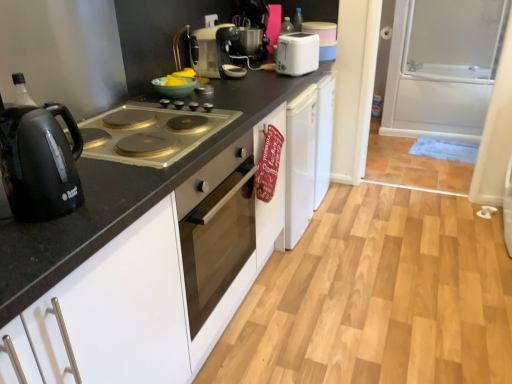
In order to click on matte silver toaster at upper center, the second kitchen appliance in the top-to-bottom sequence in this screenshot , I will do `click(211, 49)`.

Where is `matte black oven at center`? The width and height of the screenshot is (512, 384). matte black oven at center is located at coordinates (377, 297).

Where is `matte silver gas stove at left`? Image resolution: width=512 pixels, height=384 pixels. matte silver gas stove at left is located at coordinates (150, 133).

This screenshot has width=512, height=384. What do you see at coordinates (136, 257) in the screenshot?
I see `black matte countertop at center` at bounding box center [136, 257].

Locate an element on the screen. The height and width of the screenshot is (384, 512). black matte countertop at center is located at coordinates (136, 257).

What is the approximate width of white plastic toaster at upper center, acting as the third kitchen appliance starting from the bottom?

6.72 inches.

Image resolution: width=512 pixels, height=384 pixels. What do you see at coordinates (442, 67) in the screenshot?
I see `transparent glass screen door at right` at bounding box center [442, 67].

This screenshot has width=512, height=384. What are the coordinates of `matte silver toaster at upper center, the second kitchen appliance in the top-to-bottom sequence` in the screenshot? It's located at (211, 49).

Considering the relative sizes of black glossy electric kettle at left, which is the first kitchen appliance from bottom to top, and transparent glass screen door at right in the image provided, is black glossy electric kettle at left, which is the first kitchen appliance from bottom to top, shorter than transparent glass screen door at right?

Yes, black glossy electric kettle at left, which is the first kitchen appliance from bottom to top, is shorter than transparent glass screen door at right.

Who is bigger, black glossy electric kettle at left, which is the first kitchen appliance from bottom to top, or transparent glass screen door at right?

transparent glass screen door at right is bigger.

Locate an element on the screen. The image size is (512, 384). screen door that is behind the black glossy electric kettle at left, which is the first kitchen appliance from bottom to top is located at coordinates (442, 67).

Could you tell me if black glossy electric kettle at left, acting as the 3th kitchen appliance starting from the back, is facing transparent glass screen door at right?

No, black glossy electric kettle at left, acting as the 3th kitchen appliance starting from the back, is not aimed at transparent glass screen door at right.

Which is more to the left, matte silver toaster at upper center, marked as the 2th kitchen appliance in a left-to-right arrangement, or white plastic toaster at upper center, acting as the third kitchen appliance starting from the bottom?

matte silver toaster at upper center, marked as the 2th kitchen appliance in a left-to-right arrangement.

From the image's perspective, is matte silver toaster at upper center, marked as the 2th kitchen appliance in a left-to-right arrangement, above or below white plastic toaster at upper center, which appears as the first kitchen appliance when viewed from the top?

Clearly, from the image's perspective, matte silver toaster at upper center, marked as the 2th kitchen appliance in a left-to-right arrangement, is below white plastic toaster at upper center, which appears as the first kitchen appliance when viewed from the top.

Considering the sizes of matte silver toaster at upper center, marked as the 2th kitchen appliance in a left-to-right arrangement, and white plastic toaster at upper center, the first kitchen appliance from the back, in the image, is matte silver toaster at upper center, marked as the 2th kitchen appliance in a left-to-right arrangement, wider or thinner than white plastic toaster at upper center, the first kitchen appliance from the back,?

matte silver toaster at upper center, marked as the 2th kitchen appliance in a left-to-right arrangement, is wider than white plastic toaster at upper center, the first kitchen appliance from the back.

Would you consider matte silver toaster at upper center, the 2th kitchen appliance positioned from the front, to be distant from white plastic toaster at upper center, acting as the third kitchen appliance starting from the bottom?

matte silver toaster at upper center, the 2th kitchen appliance positioned from the front, is actually quite close to white plastic toaster at upper center, acting as the third kitchen appliance starting from the bottom.

Is point (335, 240) positioned behind point (31, 372)?

Yes, it is behind point (31, 372).

Is black matte countertop at center at the back of matte black oven at center?

No, matte black oven at center is not facing away from black matte countertop at center.

From the image's perspective, between matte black oven at center and black matte countertop at center, who is located below?

matte black oven at center, from the image's perspective.

Considering the positions of objects matte black oven at center and black matte countertop at center in the image provided, who is behind, matte black oven at center or black matte countertop at center?

matte black oven at center is further away from the camera.

Is black glossy electric kettle at left, positioned as the first kitchen appliance in left-to-right order, taller than matte silver gas stove at left?

Correct, black glossy electric kettle at left, positioned as the first kitchen appliance in left-to-right order, is much taller as matte silver gas stove at left.

How much distance is there between black glossy electric kettle at left, which is the first kitchen appliance from bottom to top, and matte silver gas stove at left?

A distance of 26.65 centimeters exists between black glossy electric kettle at left, which is the first kitchen appliance from bottom to top, and matte silver gas stove at left.

Image resolution: width=512 pixels, height=384 pixels. I want to click on gas stove behind the black glossy electric kettle at left, placed as the first kitchen appliance when sorted from front to back, so click(150, 133).

Considering the sizes of black glossy electric kettle at left, positioned as the first kitchen appliance in left-to-right order, and matte silver gas stove at left in the image, is black glossy electric kettle at left, positioned as the first kitchen appliance in left-to-right order, wider or thinner than matte silver gas stove at left?

Considering their sizes, black glossy electric kettle at left, positioned as the first kitchen appliance in left-to-right order, looks slimmer than matte silver gas stove at left.

Is matte silver toaster at upper center, the second kitchen appliance positioned from the bottom, at the back of matte silver gas stove at left?

matte silver gas stove at left does not have its back to matte silver toaster at upper center, the second kitchen appliance positioned from the bottom.

Considering the sizes of objects matte silver gas stove at left and matte silver toaster at upper center, the second kitchen appliance in the top-to-bottom sequence, in the image provided, who is shorter, matte silver gas stove at left or matte silver toaster at upper center, the second kitchen appliance in the top-to-bottom sequence,?

Standing shorter between the two is matte silver gas stove at left.

Can you tell me how much matte silver gas stove at left and matte silver toaster at upper center, positioned as the 2th kitchen appliance in back-to-front order, differ in facing direction?

There is a 0.333-degree angle between the facing directions of matte silver gas stove at left and matte silver toaster at upper center, positioned as the 2th kitchen appliance in back-to-front order.

From the image's perspective, is matte silver gas stove at left over matte silver toaster at upper center, the 2th kitchen appliance positioned from the front?

No, from the image's perspective, matte silver gas stove at left is not on top of matte silver toaster at upper center, the 2th kitchen appliance positioned from the front.

You are a GUI agent. You are given a task and a screenshot of the screen. Output one action in this format:
    pyautogui.click(x=<x>, y=<y>)
    Task: Click on the plain on the left of transparent glass screen door at right
    The image size is (512, 384).
    Given the screenshot: What is the action you would take?
    pyautogui.click(x=377, y=297)

From a real-world perspective, is matte black oven at center under transparent glass screen door at right?

Indeed, from a real-world perspective, matte black oven at center is positioned beneath transparent glass screen door at right.

Is matte black oven at center turned away from transparent glass screen door at right?

No, matte black oven at center is not facing away from transparent glass screen door at right.

Is matte silver gas stove at left at the back of matte black oven at center?

No, matte black oven at center is not facing the opposite direction of matte silver gas stove at left.

In terms of size, does matte black oven at center appear bigger or smaller than matte silver gas stove at left?

In the image, matte black oven at center appears to be larger than matte silver gas stove at left.

How many degrees apart are the facing directions of matte black oven at center and matte silver gas stove at left?

89.8 degrees.

This screenshot has height=384, width=512. Find the location of `screen door located behind the black glossy electric kettle at left, positioned as the first kitchen appliance in left-to-right order`. screen door located behind the black glossy electric kettle at left, positioned as the first kitchen appliance in left-to-right order is located at coordinates (442, 67).

I want to click on kitchen appliance above the matte silver toaster at upper center, marked as the 2th kitchen appliance in a left-to-right arrangement (from the image's perspective), so click(x=297, y=53).

Considering their positions, is black matte countertop at center positioned closer to transparent glass screen door at right than matte silver gas stove at left?

black matte countertop at center is positioned closer to the anchor transparent glass screen door at right.

Considering their positions, is black matte countertop at center positioned closer to matte silver toaster at upper center, the 2th kitchen appliance positioned from the front, than matte black oven at center?

black matte countertop at center is closer to matte silver toaster at upper center, the 2th kitchen appliance positioned from the front.

When comparing their distances from black matte countertop at center, does white plastic toaster at upper center, acting as the third kitchen appliance starting from the bottom, or transparent glass screen door at right seem closer?

white plastic toaster at upper center, acting as the third kitchen appliance starting from the bottom, is closer to black matte countertop at center.

When comparing their distances from matte silver gas stove at left, does transparent glass screen door at right or white plastic toaster at upper center, acting as the third kitchen appliance starting from the bottom, seem closer?

The object closer to matte silver gas stove at left is white plastic toaster at upper center, acting as the third kitchen appliance starting from the bottom.

Based on their spatial positions, is black glossy electric kettle at left, which is the third kitchen appliance from right to left, or white plastic toaster at upper center, which is the 3th kitchen appliance from left to right, further from black matte countertop at center?

white plastic toaster at upper center, which is the 3th kitchen appliance from left to right, lies further to black matte countertop at center than the other object.

When comparing their distances from black glossy electric kettle at left, positioned as the first kitchen appliance in left-to-right order, does matte black oven at center or transparent glass screen door at right seem further?

The object further to black glossy electric kettle at left, positioned as the first kitchen appliance in left-to-right order, is transparent glass screen door at right.

Estimate the real-world distances between objects in this image. Which object is closer to matte silver toaster at upper center, the second kitchen appliance in the top-to-bottom sequence, matte black oven at center or white plastic toaster at upper center, which appears as the first kitchen appliance when viewed from the top?

white plastic toaster at upper center, which appears as the first kitchen appliance when viewed from the top.

Estimate the real-world distances between objects in this image. Which object is further from black matte countertop at center, matte silver toaster at upper center, the second kitchen appliance in the top-to-bottom sequence, or white plastic toaster at upper center, the first kitchen appliance viewed from the right?

Among the two, white plastic toaster at upper center, the first kitchen appliance viewed from the right, is located further to black matte countertop at center.

Locate an element on the screen. The image size is (512, 384). countertop situated between black glossy electric kettle at left, placed as the first kitchen appliance when sorted from front to back, and matte black oven at center from left to right is located at coordinates (136, 257).

Where is `plain between matte silver gas stove at left and transparent glass screen door at right`? plain between matte silver gas stove at left and transparent glass screen door at right is located at coordinates (377, 297).

Find the location of a particular element. This screenshot has width=512, height=384. plain positioned between black matte countertop at center and transparent glass screen door at right from near to far is located at coordinates 377,297.

Locate an element on the screen. gas stove between black matte countertop at center and transparent glass screen door at right along the z-axis is located at coordinates (150, 133).